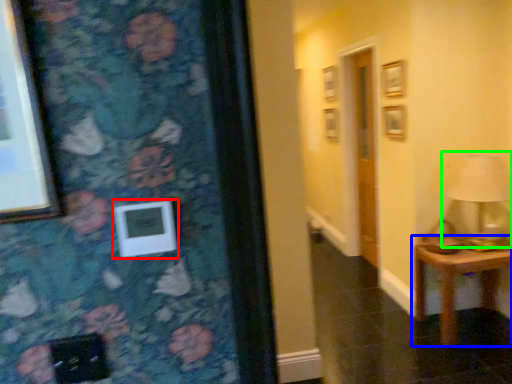
Question: Which is nearer to the picture frame (highlighted by a red box)? table (highlighted by a blue box) or table lamp (highlighted by a green box).

Choices:
 (A) table
 (B) table lamp

Answer: (A)